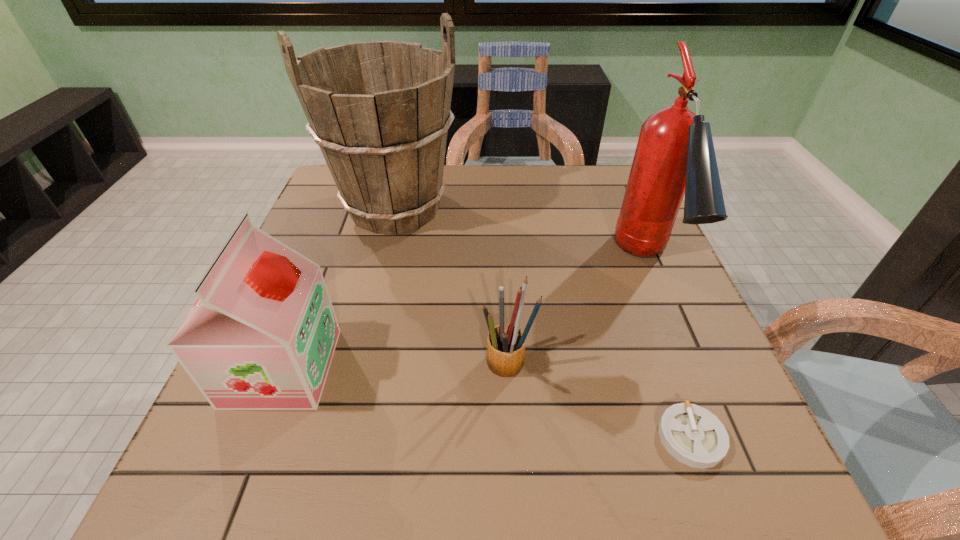
Locate an element on the screen. Image resolution: width=960 pixels, height=540 pixels. bucket is located at coordinates pos(380,112).

Where is `fire extinguisher`? This screenshot has height=540, width=960. fire extinguisher is located at coordinates (675, 156).

Where is `the third tallest object`? The image size is (960, 540). the third tallest object is located at coordinates (261, 335).

I want to click on the fourth tallest object, so click(x=506, y=343).

I want to click on pencil box, so 506,343.

Locate an element on the screen. This screenshot has height=540, width=960. the shortest object is located at coordinates (694, 436).

Where is `free space located 0.120m on the front of the bucket`? free space located 0.120m on the front of the bucket is located at coordinates (377, 282).

This screenshot has width=960, height=540. I want to click on blank space located 0.120m at the nozzle end of the fire extinguisher, so click(x=691, y=367).

Locate an element on the screen. free spot located 0.240m with the cap open on the soya milk is located at coordinates (458, 367).

This screenshot has height=540, width=960. I want to click on free location located 0.180m on the right of the fourth tallest object, so click(630, 366).